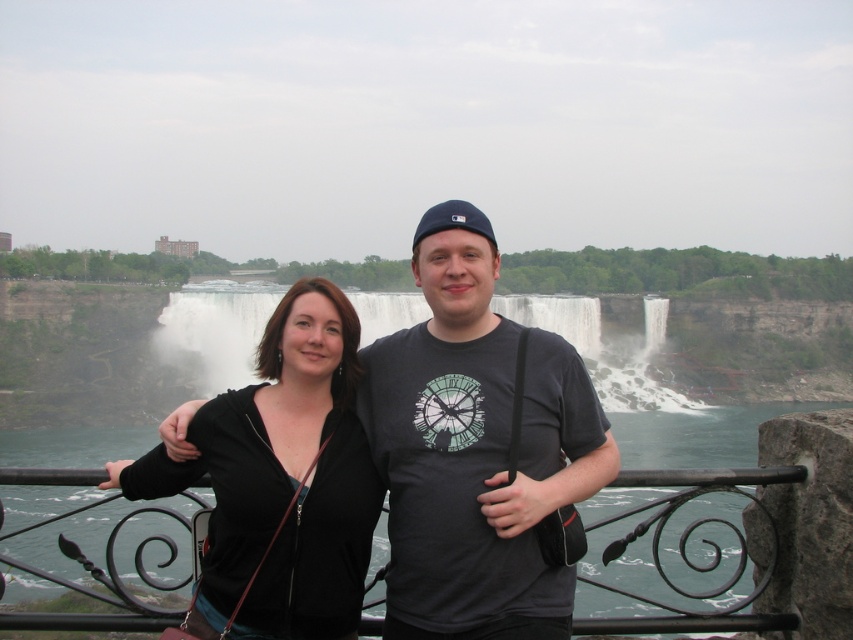
You are a photographer trying to capture a photo of both individuals in the scene. You notice two points marked in the image. The first point is at coordinate point (x=434, y=609) and the second is at point (x=154, y=628). Which point should you focus on to ensure both people are in the frame?

You should focus on point (x=434, y=609) because it is in front of point (x=154, y=628), so focusing there will keep both individuals within the frame.